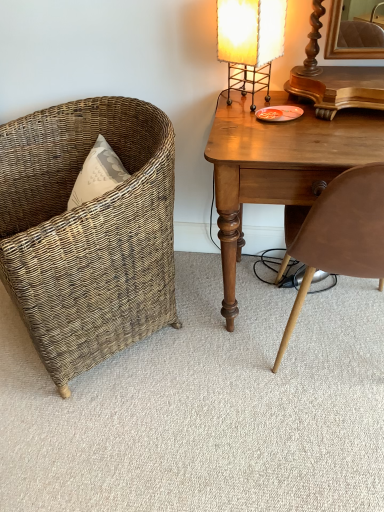
Find the location of a particular element. The height and width of the screenshot is (512, 384). empty space that is ontop of wooden desk at right (from a real-world perspective) is located at coordinates (x=309, y=130).